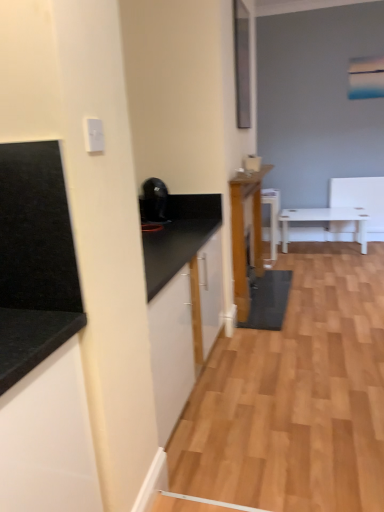
Question: Is wooden cabinet at center, arranged as the 1th cabinetry when viewed from the right, oriented towards black glossy coffee maker at upper center?

Choices:
 (A) yes
 (B) no

Answer: (B)

Question: Does wooden cabinet at center, acting as the second cabinetry starting from the left, come in front of black glossy coffee maker at upper center?

Choices:
 (A) no
 (B) yes

Answer: (A)

Question: Is wooden cabinet at center, arranged as the 1th cabinetry when viewed from the right, not inside black glossy coffee maker at upper center?

Choices:
 (A) yes
 (B) no

Answer: (A)

Question: Is wooden cabinet at center, arranged as the 1th cabinetry when viewed from the right, taller than black glossy coffee maker at upper center?

Choices:
 (A) no
 (B) yes

Answer: (B)

Question: Does wooden cabinet at center, acting as the second cabinetry starting from the left, have a smaller size compared to black glossy coffee maker at upper center?

Choices:
 (A) no
 (B) yes

Answer: (A)

Question: Is the position of black granite countertop at left, which appears as the first countertop when viewed from the back, less distant than that of black granite countertop at left, which is counted as the 2th cabinetry, starting from the back?

Choices:
 (A) yes
 (B) no

Answer: (B)

Question: From a real-world perspective, is black granite countertop at left, which appears as the second countertop when viewed from the front, below black granite countertop at left, which is the 1th cabinetry in left-to-right order?

Choices:
 (A) yes
 (B) no

Answer: (A)

Question: Considering the relative sizes of black granite countertop at left, which appears as the second countertop when viewed from the front, and black granite countertop at left, which ranks as the first cabinetry in front-to-back order, in the image provided, is black granite countertop at left, which appears as the second countertop when viewed from the front, taller than black granite countertop at left, which ranks as the first cabinetry in front-to-back order,?

Choices:
 (A) yes
 (B) no

Answer: (A)

Question: Is black granite countertop at left, which appears as the first countertop when viewed from the back, bigger than black granite countertop at left, which ranks as the first cabinetry in front-to-back order?

Choices:
 (A) yes
 (B) no

Answer: (A)

Question: Is black granite countertop at left, which appears as the second countertop when viewed from the front, not close to black granite countertop at left, which is the second cabinetry in right-to-left order?

Choices:
 (A) yes
 (B) no

Answer: (B)

Question: Is black granite countertop at left, which appears as the second countertop when viewed from the front, placed right next to black granite countertop at left, which is the second cabinetry in right-to-left order?

Choices:
 (A) yes
 (B) no

Answer: (B)

Question: From the image's perspective, is wooden cabinet at center, acting as the second cabinetry starting from the left, located above black granite countertop at left, which is the 1th cabinetry in left-to-right order?

Choices:
 (A) yes
 (B) no

Answer: (A)